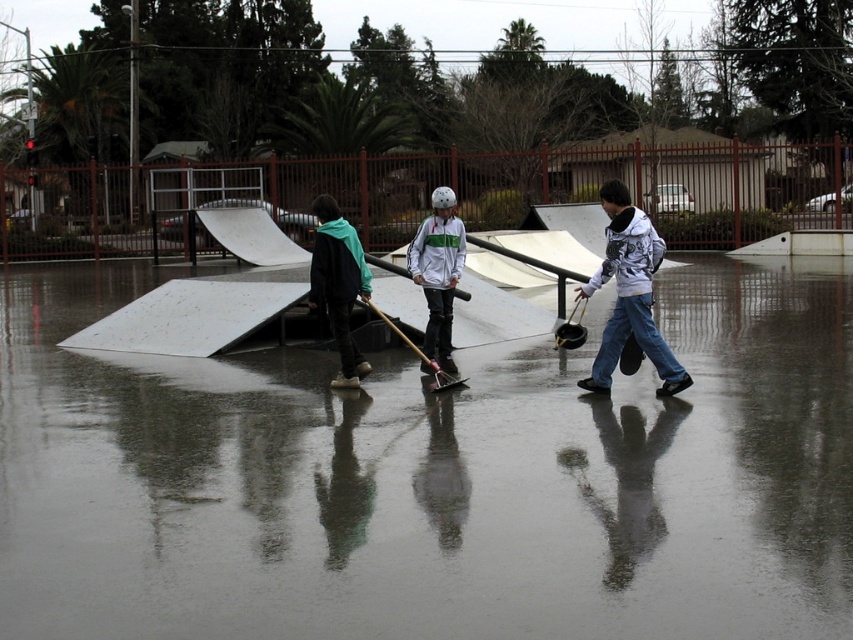
Which is in front, point (631, 310) or point (450, 230)?

Positioned in front is point (631, 310).

Can you confirm if white printed hoodie at center is positioned to the right of white matte jacket at center?

Indeed, white printed hoodie at center is positioned on the right side of white matte jacket at center.

Find the location of a particular element. This screenshot has width=853, height=640. white printed hoodie at center is located at coordinates tap(630, 292).

The height and width of the screenshot is (640, 853). Find the location of `white printed hoodie at center`. white printed hoodie at center is located at coordinates (630, 292).

Between point (621, 204) and point (433, 388), which one is positioned behind?

The point (433, 388) is more distant.

Between white printed hoodie at center and metallic silver skateboard at center, which one is positioned higher?

white printed hoodie at center is above.

Is point (614, 256) more distant than point (451, 381)?

No, it is not.

What are the coordinates of `white printed hoodie at center` in the screenshot? It's located at tap(630, 292).

Between reflective wet pavement at center and white matte jacket at center, which one has less height?

Standing shorter between the two is white matte jacket at center.

Which is more to the left, reflective wet pavement at center or white matte jacket at center?

Positioned to the left is reflective wet pavement at center.

Who is more forward, (786, 472) or (425, 266)?

Point (786, 472) is more forward.

Identify the location of reflective wet pavement at center. (431, 480).